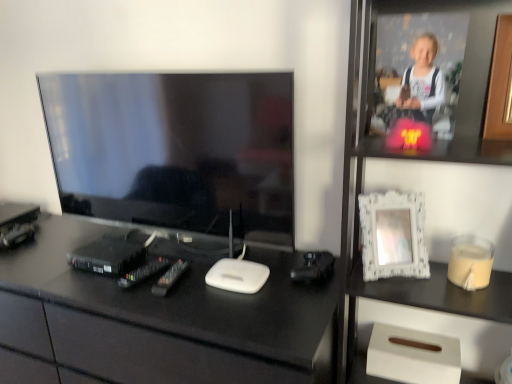
Question: In terms of height, does beige matte candle at right look taller or shorter compared to wooden at upper right, the first picture frame viewed from the right?

Choices:
 (A) short
 (B) tall

Answer: (A)

Question: Would you say beige matte candle at right is inside or outside wooden at upper right, the first picture frame positioned from the top?

Choices:
 (A) inside
 (B) outside

Answer: (B)

Question: Which of these objects is positioned farthest from the white textured frame at upper right?

Choices:
 (A) wooden at upper right, which is counted as the second picture frame, starting from the bottom
 (B) white lace picture frame at upper right, which is counted as the second picture frame, starting from the right
 (C) matte black tv at left
 (D) black glossy desk at center
 (E) beige matte candle at right

Answer: (C)

Question: Considering the real-world distances, which object is farthest from the beige matte candle at right?

Choices:
 (A) white textured frame at upper right
 (B) matte black tv at left
 (C) white lace picture frame at upper right, which is counted as the second picture frame, starting from the right
 (D) wooden at upper right, which is counted as the second picture frame, starting from the bottom
 (E) black glossy desk at center

Answer: (B)